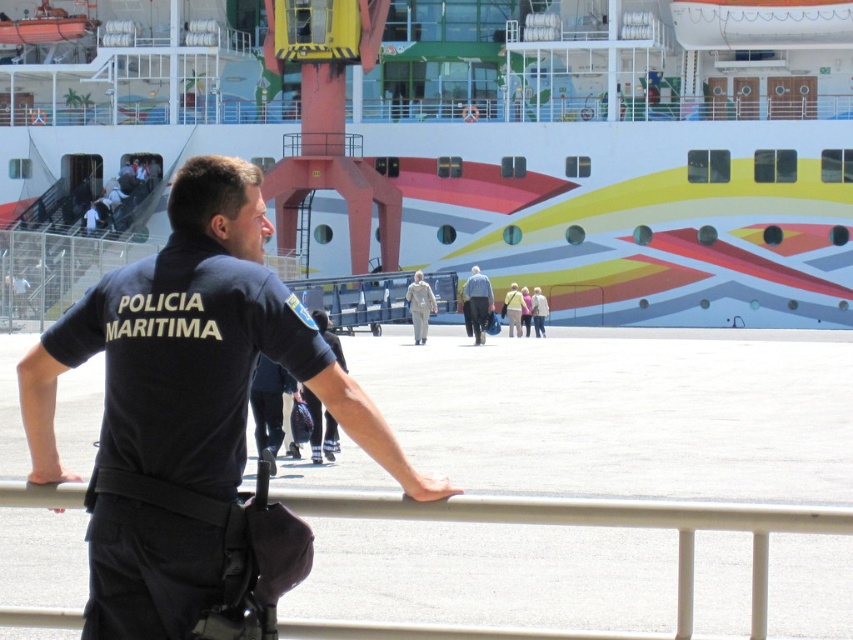
Question: Where is black uniform at center located in relation to light beige fabric jacket at center in the image?

Choices:
 (A) below
 (B) above

Answer: (A)

Question: Which object is positioned closest to the light beige fabric jacket at center?

Choices:
 (A) light blue denim jeans at center
 (B) white matte statue at center

Answer: (B)

Question: Is black uniform at center to the right of light beige fabric jacket at center from the viewer's perspective?

Choices:
 (A) yes
 (B) no

Answer: (B)

Question: Which of the following is the closest to the observer?

Choices:
 (A) light beige fabric jacket at center
 (B) black fabric uniform at center

Answer: (B)

Question: Does white metal rail at center have a greater width compared to light beige fabric jacket at center?

Choices:
 (A) no
 (B) yes

Answer: (B)

Question: Which object is positioned closest to the light beige fabric jacket at center?

Choices:
 (A) black uniform at center
 (B) light blue denim jeans at center
 (C) black fabric uniform at center

Answer: (B)